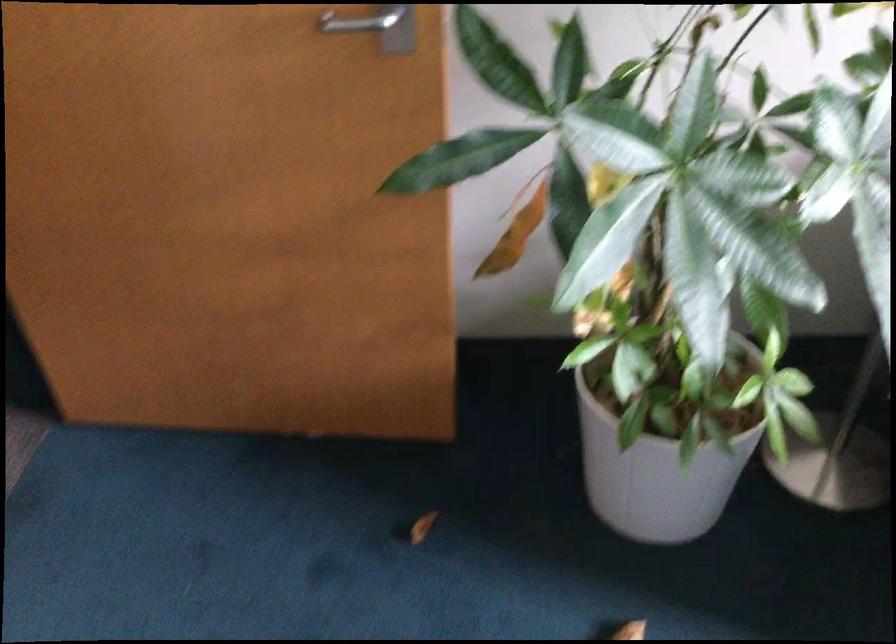
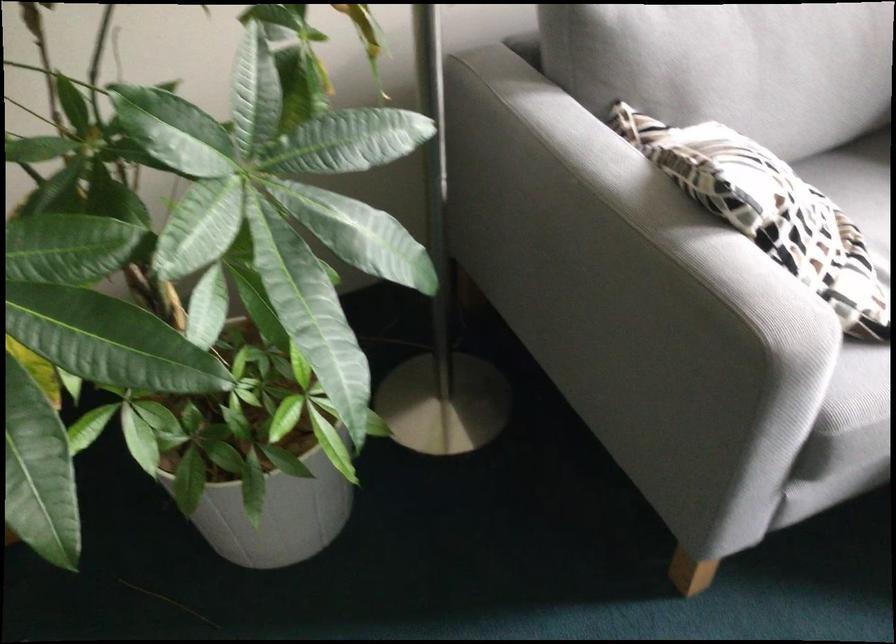
Question: The first image is from the beginning of the video and the second image is from the end. How did the camera likely rotate when shooting the video?

Choices:
 (A) Left
 (B) Right
 (C) Up
 (D) Down

Answer: (B)